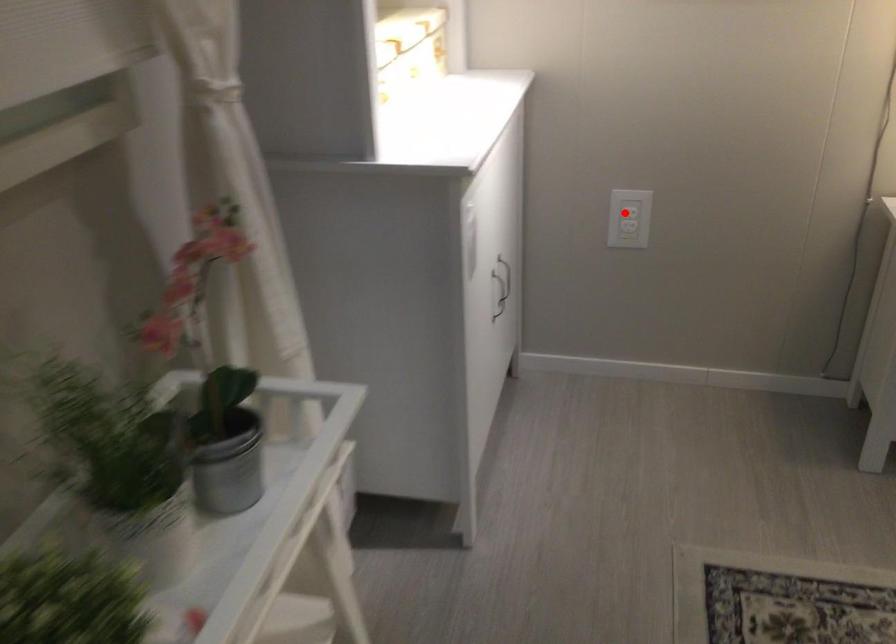
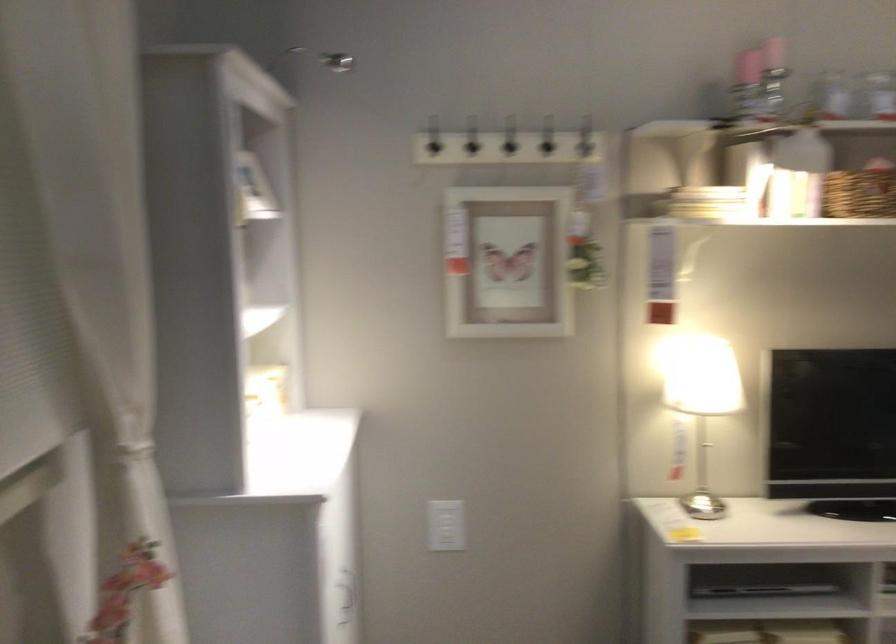
Find the pixel in the second image that matches the highlighted location in the first image.

(445, 526)